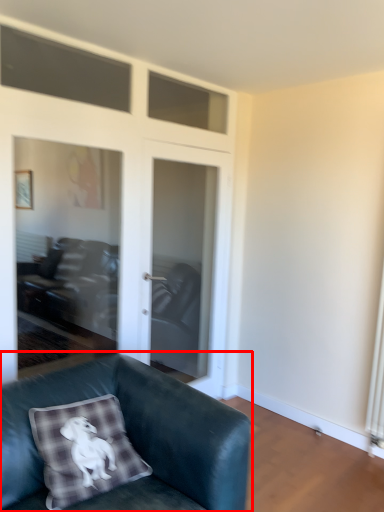
Question: In this image, where is studio couch (annotated by the red box) located relative to screen door?

Choices:
 (A) left
 (B) right

Answer: (A)